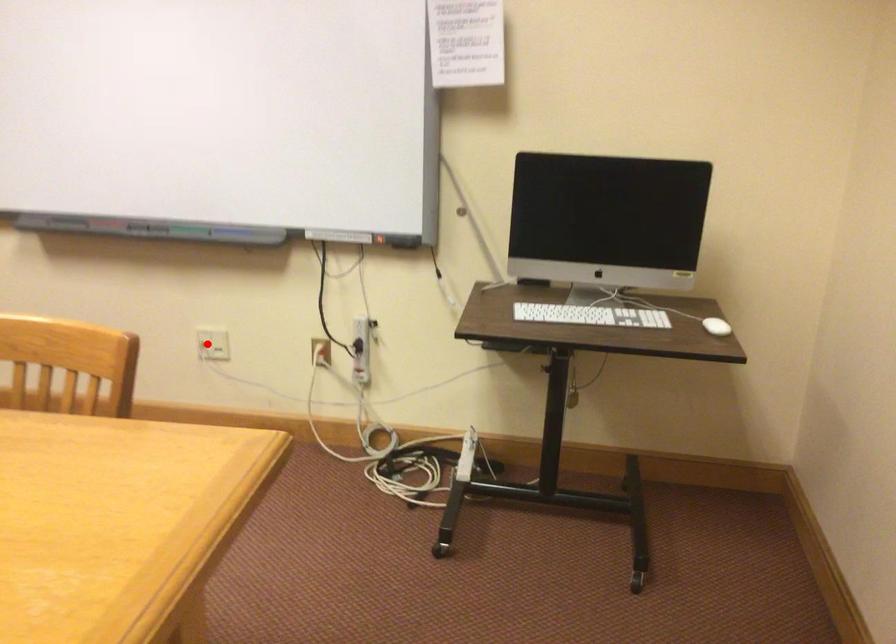
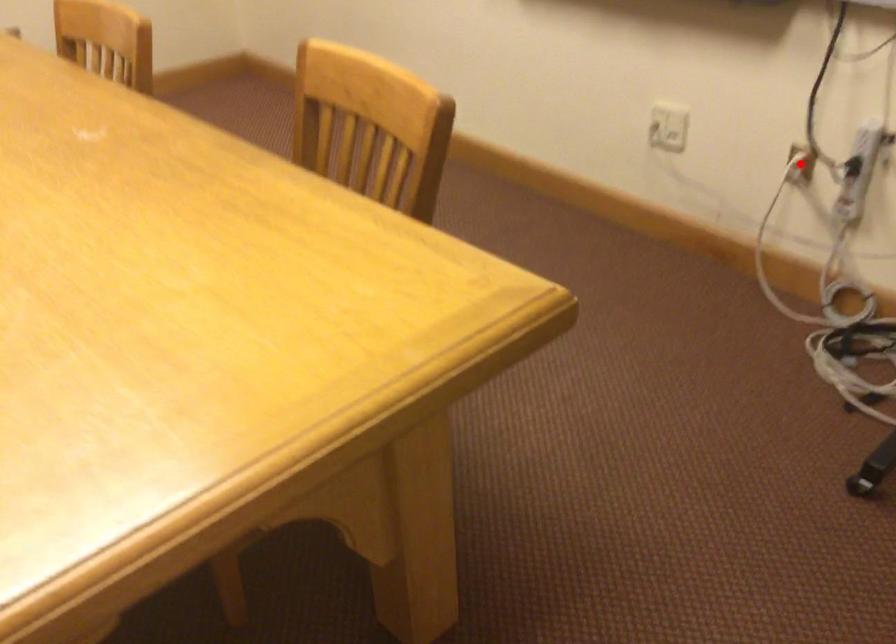
I am providing you with two images of the same scene from different viewpoints. A red point is marked on the first image and another point is marked on the second image. Is the marked point in image1 the same physical position as the marked point in image2?

No